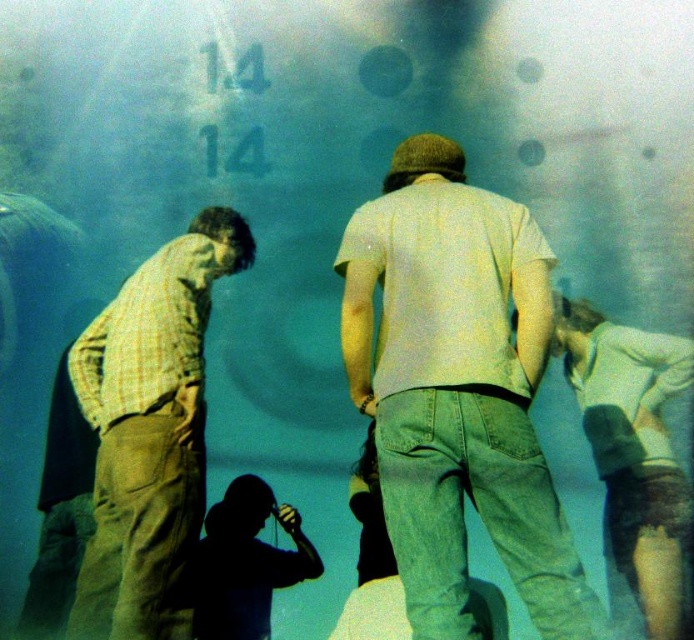
You are a photographer trying to capture a clear shot of the large figure through the glass. You notice two people in the foreground blocking your view. Which of the two, the light gray cotton shirt at center or the light blue denim shorts at lower right, is wider and thus more obstructing your view?

The light gray cotton shirt at center is wider than the light blue denim shorts at lower right, so it is more obstructing your view.

You are standing in the museum and see the light gray cotton shirt at center and the light blue denim shorts at lower right. Which object is taller?

The light gray cotton shirt at center is much taller than the light blue denim shorts at lower right.